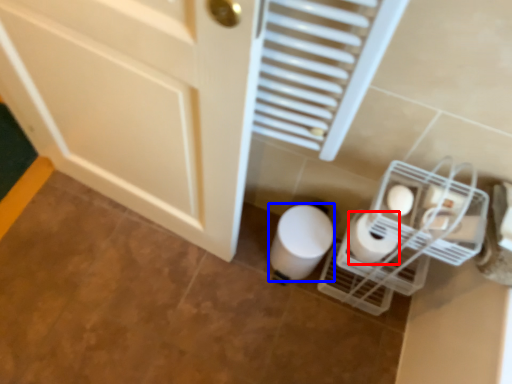
Question: Which of the following is the farthest to the observer, toilet paper (highlighted by a red box) or toilet paper (highlighted by a blue box)?

Choices:
 (A) toilet paper
 (B) toilet paper

Answer: (B)